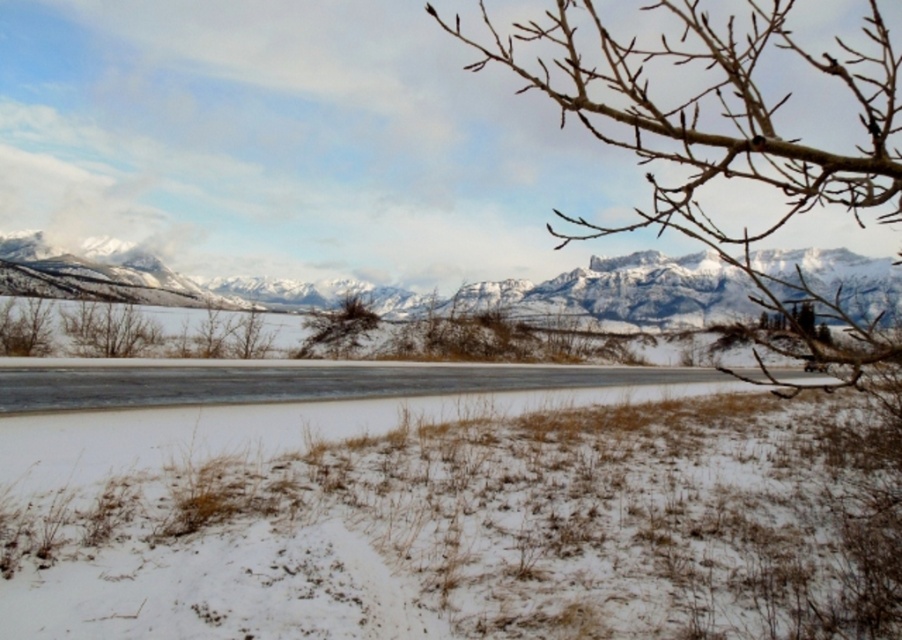
You are a hiker planning to cross the snow between the two snowy granite mountains at center. The path you want to take is directly between them. Your equipment can handle paths narrower than 70 meters. Will you be able to safely cross?

The snowy granite mountains at center are 75.55 meters apart. Since your equipment can handle paths narrower than 70 meters, the distance is too wide, so you cannot safely cross.

You are a hiker trying to cross the snow covered road. You see the smooth ice at center and the brown textured bush at center. Which object is closer to the ground?

The smooth ice at center is below brown textured bush at center, so the smooth ice at center is closer to the ground.

You are driving a car that is 2 meters wide. You see the snowy granite mountains at center and the brown textured bush at center in your path. Can your car pass through the space between them?

The snowy granite mountains at center might be wider than the brown textured bush at center, so it is uncertain if the car can pass through the space between them. Check the actual width before proceeding.